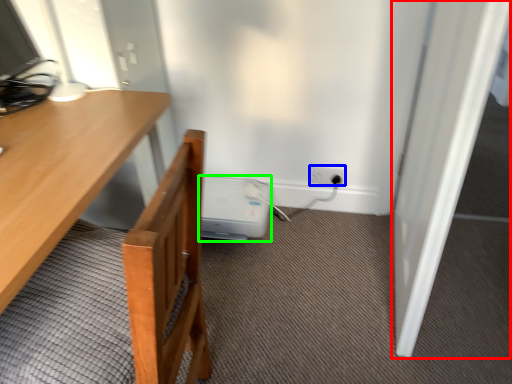
Question: Which is nearer to the door (highlighted by a red box)? electric outlet (highlighted by a blue box) or water heater (highlighted by a green box).

Choices:
 (A) electric outlet
 (B) water heater

Answer: (A)